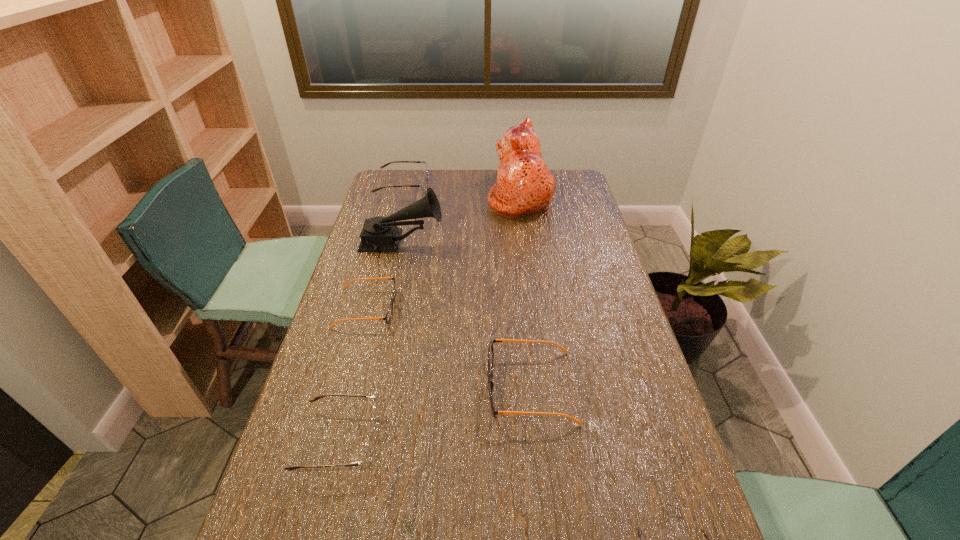
Locate an element on the screen. vacant point located between the second smallest brown spectacles and the biggest brown spectacles is located at coordinates (371, 313).

You are a GUI agent. You are given a task and a screenshot of the screen. Output one action in this format:
    pyautogui.click(x=<x>, y=<y>)
    Task: Click on the free point between the fourth nearest spectacles and the cat
    Image resolution: width=960 pixels, height=540 pixels.
    Given the screenshot: What is the action you would take?
    pyautogui.click(x=444, y=251)

Where is `free area in between the second biggest brown spectacles and the phonograph_record`? The height and width of the screenshot is (540, 960). free area in between the second biggest brown spectacles and the phonograph_record is located at coordinates (371, 341).

Where is `vacant point located between the bigger black spectacles and the second nearest brown spectacles`? vacant point located between the bigger black spectacles and the second nearest brown spectacles is located at coordinates (435, 413).

Identify the location of unoccupied area between the fourth farthest object and the second tallest object. This screenshot has height=540, width=960. (384, 275).

At what (x,y) coordinates should I click in order to perform the action: click on vacant region between the cat and the bigger black spectacles. Please return your answer as a coordinate pair (x, y). Looking at the image, I should click on (526, 291).

At what (x,y) coordinates should I click in order to perform the action: click on vacant space in between the sixth shortest object and the second farthest brown spectacles. Please return your answer as a coordinate pair (x, y). The height and width of the screenshot is (540, 960). Looking at the image, I should click on (371, 341).

Locate an element on the screen. Image resolution: width=960 pixels, height=540 pixels. object that is the fifth closest to the second farthest spectacles is located at coordinates (423, 185).

I want to click on object that stands as the fourth closest to the right black spectacles, so click(379, 234).

Where is `the closest spectacles to the farthest spectacles`? The height and width of the screenshot is (540, 960). the closest spectacles to the farthest spectacles is located at coordinates (388, 315).